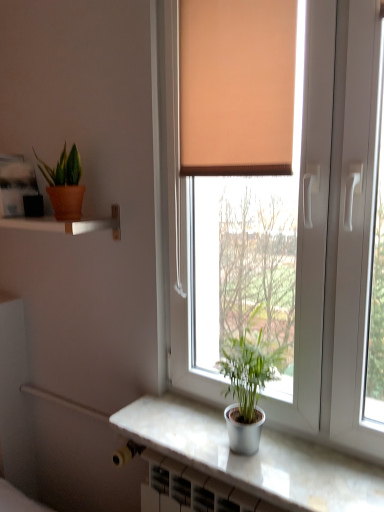
Question: Is matte terracotta pot at upper left, which ranks as the first houseplant in left-to-right order, thinner than matte white shelf at upper left?

Choices:
 (A) no
 (B) yes

Answer: (B)

Question: Does matte terracotta pot at upper left, the 2th houseplant from the front, come behind matte white shelf at upper left?

Choices:
 (A) yes
 (B) no

Answer: (A)

Question: From the image's perspective, is matte terracotta pot at upper left, which ranks as the first houseplant in left-to-right order, on matte white shelf at upper left?

Choices:
 (A) no
 (B) yes

Answer: (B)

Question: From the image's perspective, is matte terracotta pot at upper left, the 2th houseplant when ordered from bottom to top, below matte white shelf at upper left?

Choices:
 (A) yes
 (B) no

Answer: (B)

Question: Considering the relative positions of matte terracotta pot at upper left, which appears as the second houseplant when viewed from the right, and matte white shelf at upper left in the image provided, is matte terracotta pot at upper left, which appears as the second houseplant when viewed from the right, to the left of matte white shelf at upper left from the viewer's perspective?

Choices:
 (A) yes
 (B) no

Answer: (B)

Question: Considering the relative positions of matte terracotta pot at upper left, which is the first houseplant from back to front, and matte white shelf at upper left in the image provided, is matte terracotta pot at upper left, which is the first houseplant from back to front, to the right of matte white shelf at upper left from the viewer's perspective?

Choices:
 (A) yes
 (B) no

Answer: (A)

Question: Is white marble counter top at lower center wider than silver metallic pot at window, the 2th houseplant when ordered from back to front?

Choices:
 (A) yes
 (B) no

Answer: (A)

Question: Can you confirm if white marble counter top at lower center is smaller than silver metallic pot at window, which is counted as the 1th houseplant, starting from the right?

Choices:
 (A) yes
 (B) no

Answer: (A)

Question: Could you tell me if white marble counter top at lower center is turned towards silver metallic pot at window, which is counted as the 1th houseplant, starting from the front?

Choices:
 (A) no
 (B) yes

Answer: (A)

Question: Is the position of white marble counter top at lower center less distant than that of silver metallic pot at window, which is the second houseplant in top-to-bottom order?

Choices:
 (A) no
 (B) yes

Answer: (B)

Question: Does white marble counter top at lower center have a greater height compared to silver metallic pot at window, the 2th houseplant when ordered from back to front?

Choices:
 (A) yes
 (B) no

Answer: (B)

Question: From the image's perspective, would you say white marble counter top at lower center is shown under silver metallic pot at window, the 2th houseplant when ordered from back to front?

Choices:
 (A) yes
 (B) no

Answer: (A)

Question: Is matte white shelf at upper left turned away from silver metallic pot at window, which is counted as the 2th houseplant, starting from the left?

Choices:
 (A) yes
 (B) no

Answer: (B)